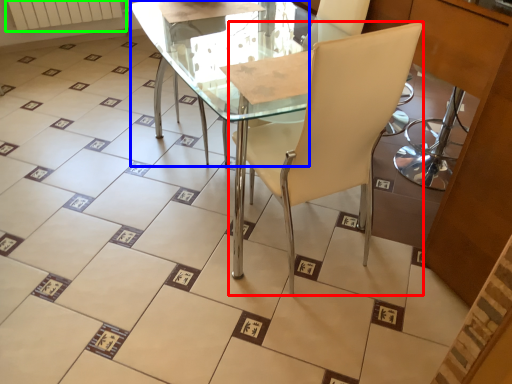
Question: Based on their relative distances, which object is nearer to chair (highlighted by a red box)? Choose from round table (highlighted by a blue box) and radiator (highlighted by a green box).

Choices:
 (A) round table
 (B) radiator

Answer: (A)